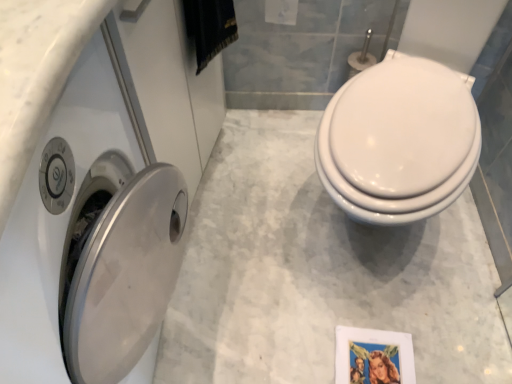
Question: Is white glossy toilet paper at upper center at the left side of white glossy toilet at right?

Choices:
 (A) yes
 (B) no

Answer: (A)

Question: From the image's perspective, is white glossy toilet paper at upper center on top of white glossy toilet at right?

Choices:
 (A) yes
 (B) no

Answer: (A)

Question: From a real-world perspective, is white glossy toilet paper at upper center over white glossy toilet at right?

Choices:
 (A) no
 (B) yes

Answer: (B)

Question: Does white glossy toilet paper at upper center have a greater height compared to white glossy toilet at right?

Choices:
 (A) yes
 (B) no

Answer: (B)

Question: Does white glossy toilet paper at upper center have a lesser height compared to white glossy toilet at right?

Choices:
 (A) yes
 (B) no

Answer: (A)

Question: Is white glossy toilet paper at upper center touching white glossy toilet at right?

Choices:
 (A) no
 (B) yes

Answer: (A)

Question: Does satin silver washer at left lie behind metallic silver picture frame at lower right?

Choices:
 (A) yes
 (B) no

Answer: (B)

Question: Is satin silver washer at left wider than metallic silver picture frame at lower right?

Choices:
 (A) no
 (B) yes

Answer: (B)

Question: From a real-world perspective, is satin silver washer at left located beneath metallic silver picture frame at lower right?

Choices:
 (A) yes
 (B) no

Answer: (B)

Question: Is metallic silver picture frame at lower right completely or partially inside satin silver washer at left?

Choices:
 (A) yes
 (B) no

Answer: (B)

Question: Does satin silver washer at left have a larger size compared to metallic silver picture frame at lower right?

Choices:
 (A) yes
 (B) no

Answer: (A)

Question: From the image's perspective, is satin silver washer at left over metallic silver picture frame at lower right?

Choices:
 (A) no
 (B) yes

Answer: (B)

Question: Is white glossy toilet at right positioned with its back to metallic silver picture frame at lower right?

Choices:
 (A) yes
 (B) no

Answer: (B)